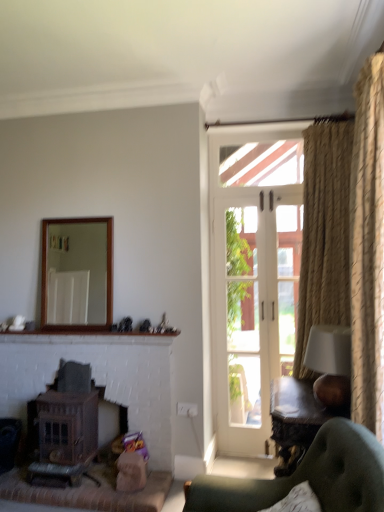
Question: Is wooden fireplace at lower left, arranged as the 1th fireplace when viewed from the left, bigger than white glass screen door at center?

Choices:
 (A) yes
 (B) no

Answer: (A)

Question: Could white glass screen door at center be considered to be inside wooden fireplace at lower left, arranged as the 1th fireplace when viewed from the left?

Choices:
 (A) no
 (B) yes

Answer: (A)

Question: Is wooden fireplace at lower left, marked as the second fireplace in a right-to-left arrangement, next to white glass screen door at center?

Choices:
 (A) yes
 (B) no

Answer: (B)

Question: Can you confirm if wooden fireplace at lower left, marked as the second fireplace in a right-to-left arrangement, is smaller than white glass screen door at center?

Choices:
 (A) yes
 (B) no

Answer: (B)

Question: From the image's perspective, is wooden fireplace at lower left, arranged as the 1th fireplace when viewed from the left, located above white glass screen door at center?

Choices:
 (A) yes
 (B) no

Answer: (B)

Question: Considering the relative sizes of wooden fireplace at lower left, arranged as the 1th fireplace when viewed from the left, and white glass screen door at center in the image provided, is wooden fireplace at lower left, arranged as the 1th fireplace when viewed from the left, taller than white glass screen door at center?

Choices:
 (A) no
 (B) yes

Answer: (A)

Question: From the image's perspective, is white brick mantle at center located above white fabric lampshade at right?

Choices:
 (A) no
 (B) yes

Answer: (A)

Question: Could you tell me if white brick mantle at center is facing white fabric lampshade at right?

Choices:
 (A) yes
 (B) no

Answer: (B)

Question: From a real-world perspective, is white brick mantle at center located higher than white fabric lampshade at right?

Choices:
 (A) no
 (B) yes

Answer: (B)

Question: Is white brick mantle at center to the left of white fabric lampshade at right from the viewer's perspective?

Choices:
 (A) yes
 (B) no

Answer: (A)

Question: Is the depth of white brick mantle at center less than that of white fabric lampshade at right?

Choices:
 (A) no
 (B) yes

Answer: (A)

Question: Does white brick mantle at center have a greater width compared to white fabric lampshade at right?

Choices:
 (A) yes
 (B) no

Answer: (B)

Question: From the image's perspective, is wooden frame mirror at upper center located beneath wooden fireplace at lower left, marked as the second fireplace in a right-to-left arrangement?

Choices:
 (A) no
 (B) yes

Answer: (A)